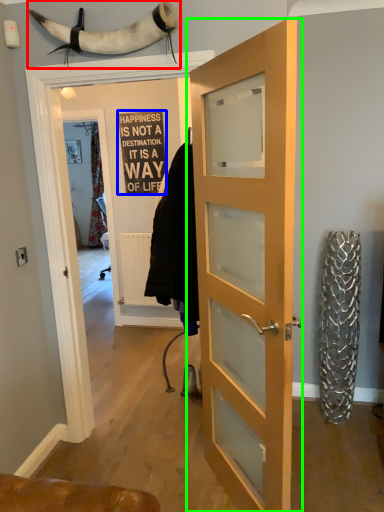
Question: Based on their relative distances, which object is nearer to animal (highlighted by a red box)? Choose from writing (highlighted by a blue box) and door (highlighted by a green box).

Choices:
 (A) writing
 (B) door

Answer: (B)